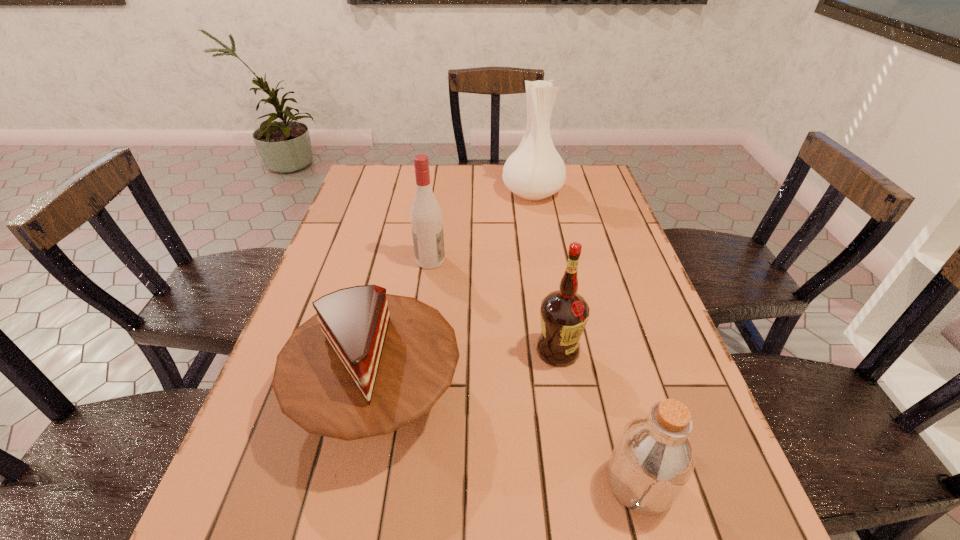
The width and height of the screenshot is (960, 540). Identify the location of vacant space positioned on the left of the bottle. (540, 483).

Locate an element on the screen. The image size is (960, 540). object present at the far edge is located at coordinates (535, 171).

I want to click on object that is at the left edge, so click(x=367, y=363).

The image size is (960, 540). I want to click on vase that is at the right edge, so click(x=535, y=171).

The width and height of the screenshot is (960, 540). Identify the location of bottle that is at the right edge. (653, 459).

Where is `object positioned at the far right corner`? object positioned at the far right corner is located at coordinates (535, 171).

Locate an element on the screen. The width and height of the screenshot is (960, 540). vacant space at the left edge is located at coordinates (370, 279).

I want to click on free location at the right edge of the desktop, so click(656, 378).

Locate an element on the screen. unoccupied area between the farther alcohol and the nearer alcohol is located at coordinates (494, 306).

At what (x,y) coordinates should I click in order to perform the action: click on free area in between the vase and the cake. Please return your answer as a coordinate pair (x, y). Looking at the image, I should click on (455, 294).